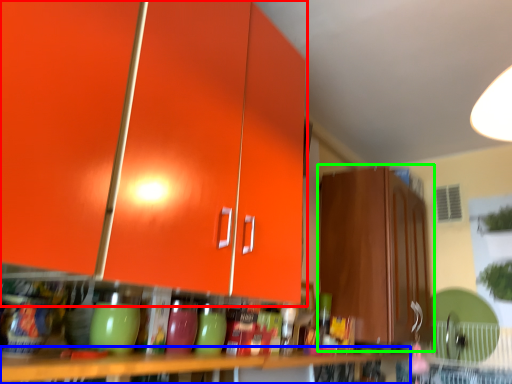
Question: Considering the real-world distances, which object is farthest from cabinetry (highlighted by a red box)? table (highlighted by a blue box) or cabinetry (highlighted by a green box)?

Choices:
 (A) table
 (B) cabinetry

Answer: (B)